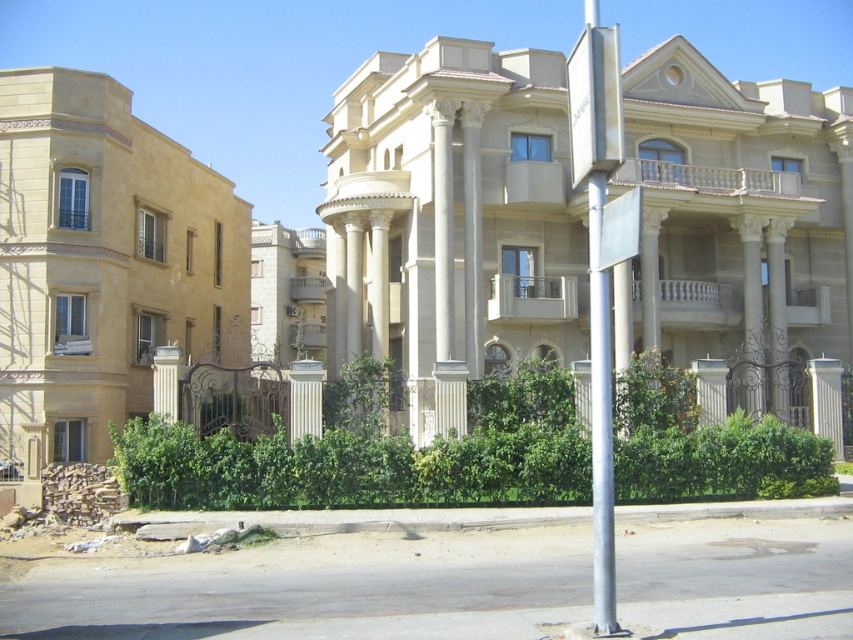
Question: Which object is positioned farthest from the white plastic sign at center?

Choices:
 (A) metallic silver sign at upper center
 (B) green leafy hedge at center
 (C) green leafy bush at center

Answer: (C)

Question: Which point appears farthest from the camera in this image?

Choices:
 (A) (650, 480)
 (B) (608, 164)
 (C) (171, 371)
 (D) (306, 420)

Answer: (D)

Question: Is white plastic sign at center bigger than white smooth pillar at center?

Choices:
 (A) yes
 (B) no

Answer: (A)

Question: In this image, where is green leafy hedge at center located relative to metallic silver sign at upper center?

Choices:
 (A) right
 (B) left

Answer: (B)

Question: Among these objects, which one is farthest from the camera?

Choices:
 (A) white smooth pillar at center
 (B) white plastic sign at center

Answer: (A)

Question: Can you confirm if green leafy hedge at center is positioned below green leafy bush at center?

Choices:
 (A) yes
 (B) no

Answer: (A)